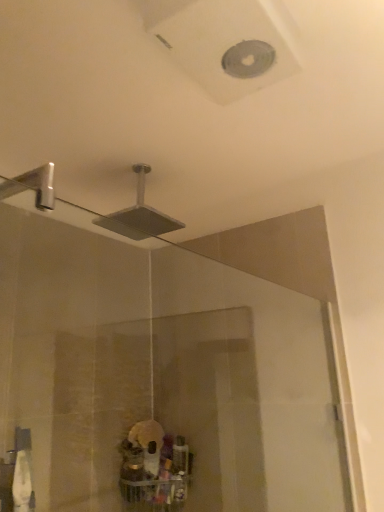
The width and height of the screenshot is (384, 512). Describe the element at coordinates (139, 215) in the screenshot. I see `metallic silver showerhead at upper center` at that location.

Locate an element on the screen. metallic silver showerhead at upper center is located at coordinates (139, 215).

This screenshot has height=512, width=384. Describe the element at coordinates (158, 377) in the screenshot. I see `transparent glass door at center` at that location.

This screenshot has height=512, width=384. In order to click on transparent glass door at center in this screenshot , I will do `click(158, 377)`.

Locate an element on the screen. Image resolution: width=384 pixels, height=512 pixels. metallic silver showerhead at upper center is located at coordinates (139, 215).

Between transparent glass door at center and metallic silver showerhead at upper center, which one appears on the right side from the viewer's perspective?

transparent glass door at center is more to the right.

Which object is closer to the camera taking this photo, transparent glass door at center or metallic silver showerhead at upper center?

transparent glass door at center is more forward.

Which is in front, point (168, 368) or point (153, 215)?

The point (153, 215) is closer.

From the image's perspective, between transparent glass door at center and metallic silver showerhead at upper center, who is located below?

transparent glass door at center is shown below in the image.

In the scene shown: From a real-world perspective, who is located higher, transparent glass door at center or metallic silver showerhead at upper center?

metallic silver showerhead at upper center is physically above.

Looking at their sizes, would you say transparent glass door at center is wider or thinner than metallic silver showerhead at upper center?

transparent glass door at center is wider than metallic silver showerhead at upper center.

Does transparent glass door at center have a greater height compared to metallic silver showerhead at upper center?

Yes.

Does transparent glass door at center have a smaller size compared to metallic silver showerhead at upper center?

Actually, transparent glass door at center might be larger than metallic silver showerhead at upper center.

Would you say metallic silver showerhead at upper center is part of transparent glass door at center's contents?

No, transparent glass door at center does not contain metallic silver showerhead at upper center.

Is transparent glass door at center touching metallic silver showerhead at upper center?

No, transparent glass door at center is not in contact with metallic silver showerhead at upper center.

Is transparent glass door at center looking in the opposite direction of metallic silver showerhead at upper center?

No, transparent glass door at center's orientation is not away from metallic silver showerhead at upper center.

Where is `shower behind the transparent glass door at center`? shower behind the transparent glass door at center is located at coordinates (139, 215).

Which is more to the left, metallic silver showerhead at upper center or transparent glass door at center?

From the viewer's perspective, metallic silver showerhead at upper center appears more on the left side.

Does metallic silver showerhead at upper center come behind transparent glass door at center?

Yes.

Does point (133, 218) appear closer or farther from the camera than point (169, 345)?

Point (133, 218) is positioned closer to the camera compared to point (169, 345).

From the image's perspective, is metallic silver showerhead at upper center above transparent glass door at center?

Yes, from the image's perspective, metallic silver showerhead at upper center is on top of transparent glass door at center.

From a real-world perspective, is metallic silver showerhead at upper center above or below transparent glass door at center?

metallic silver showerhead at upper center is situated higher than transparent glass door at center in the real world.

Which of these two, metallic silver showerhead at upper center or transparent glass door at center, is wider?

transparent glass door at center is wider.

Between metallic silver showerhead at upper center and transparent glass door at center, which one has more height?

transparent glass door at center.

Is metallic silver showerhead at upper center bigger than transparent glass door at center?

No.

Is metallic silver showerhead at upper center situated inside transparent glass door at center or outside?

metallic silver showerhead at upper center cannot be found inside transparent glass door at center.

Is there a large distance between metallic silver showerhead at upper center and transparent glass door at center?

They are positioned close to each other.

Is metallic silver showerhead at upper center facing away from transparent glass door at center?

No.

Identify the location of shower on the left of transparent glass door at center. This screenshot has height=512, width=384. (139, 215).

Find the location of `glass door in front of the metallic silver showerhead at upper center`. glass door in front of the metallic silver showerhead at upper center is located at coordinates (158, 377).

Where is `shower that appears on the left of transparent glass door at center`? Image resolution: width=384 pixels, height=512 pixels. shower that appears on the left of transparent glass door at center is located at coordinates click(x=139, y=215).